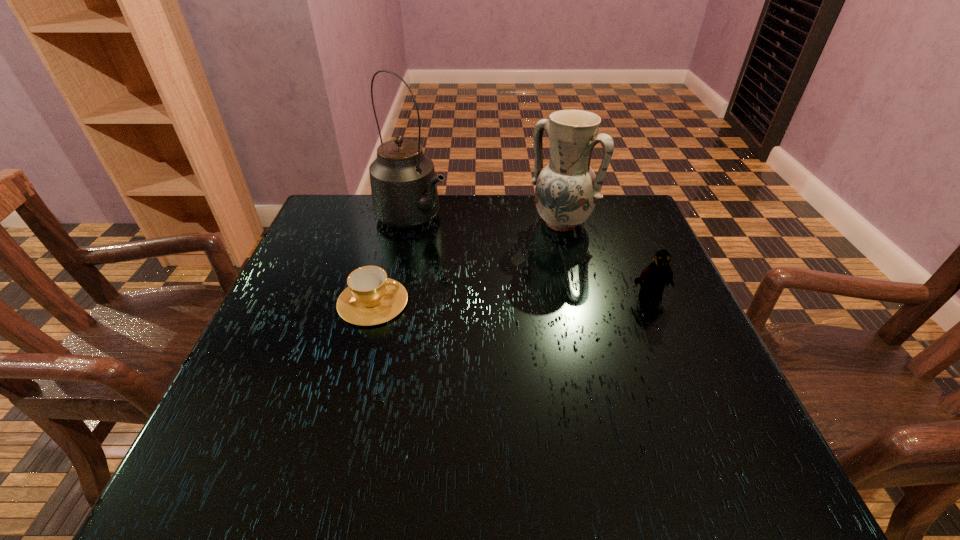
This screenshot has width=960, height=540. In order to click on free space between the kettle and the shortest object in this screenshot , I will do [x=393, y=260].

Locate an element on the screen. The width and height of the screenshot is (960, 540). vacant area between the kettle and the second object from right to left is located at coordinates (487, 220).

The image size is (960, 540). What are the coordinates of `vacant space that is in between the second shortest object and the kettle` in the screenshot? It's located at (531, 258).

At what (x,y) coordinates should I click in order to perform the action: click on vacant area that lies between the shortest object and the third tallest object. Please return your answer as a coordinate pair (x, y). Looking at the image, I should click on (511, 299).

Image resolution: width=960 pixels, height=540 pixels. Find the location of `blank region between the rightmost object and the kettle`. blank region between the rightmost object and the kettle is located at coordinates click(x=531, y=258).

The width and height of the screenshot is (960, 540). In order to click on vacant region between the second tallest object and the shortest object in this screenshot , I will do `click(467, 262)`.

Image resolution: width=960 pixels, height=540 pixels. In order to click on blank region between the tallest object and the pottery in this screenshot , I will do `click(487, 220)`.

This screenshot has height=540, width=960. Identify the location of vacant area that lies between the third object from left to right and the Lego. [x=605, y=260].

The width and height of the screenshot is (960, 540). Find the location of `vacant region between the kettle and the third tallest object`. vacant region between the kettle and the third tallest object is located at coordinates (531, 258).

Select which object appears as the second closest to the second shortest object. Please provide its 2D coordinates. Your answer should be formatted as a tuple, i.e. [(x, y)], where the tuple contains the x and y coordinates of a point satisfying the conditions above.

[(404, 191)]